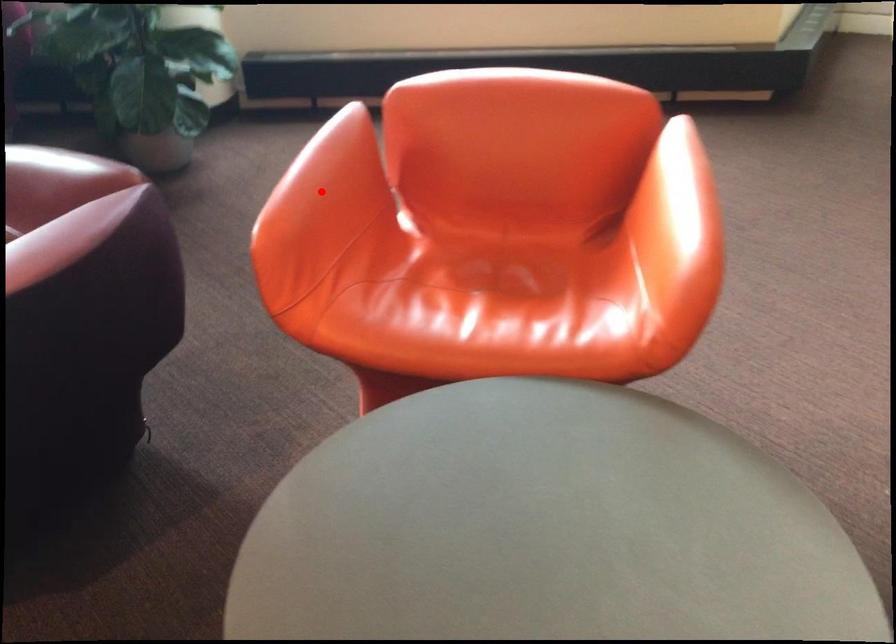
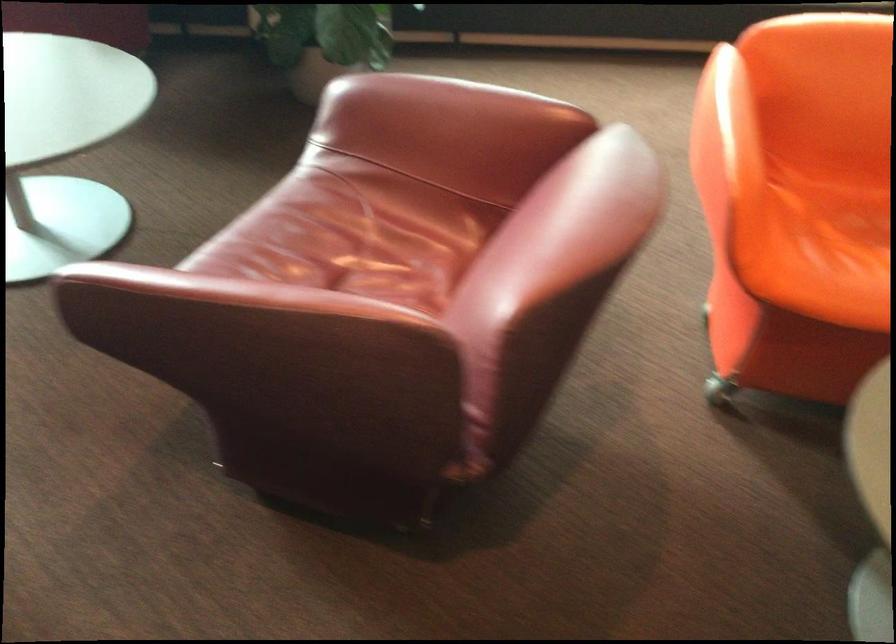
In the second image, find the point that corresponds to the highlighted location in the first image.

(762, 135)